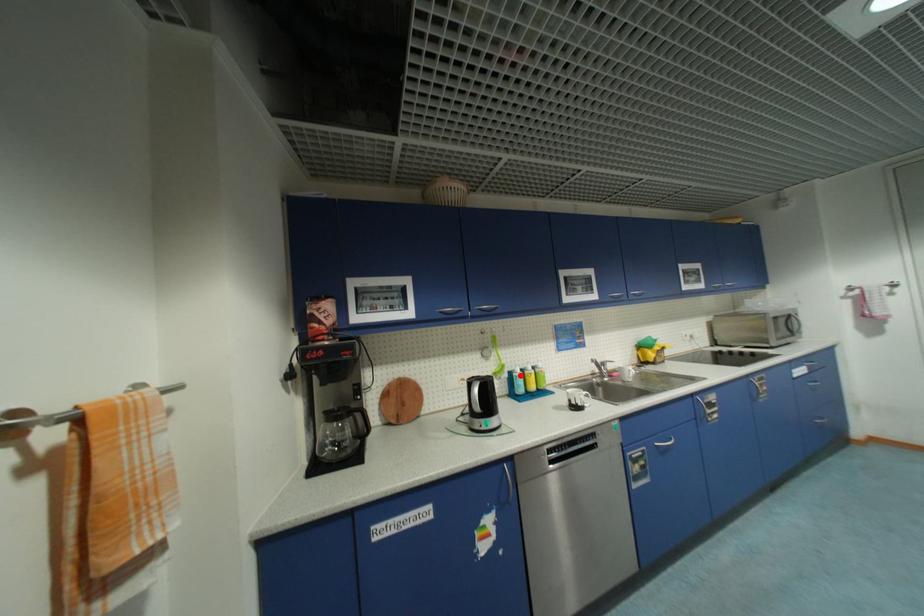
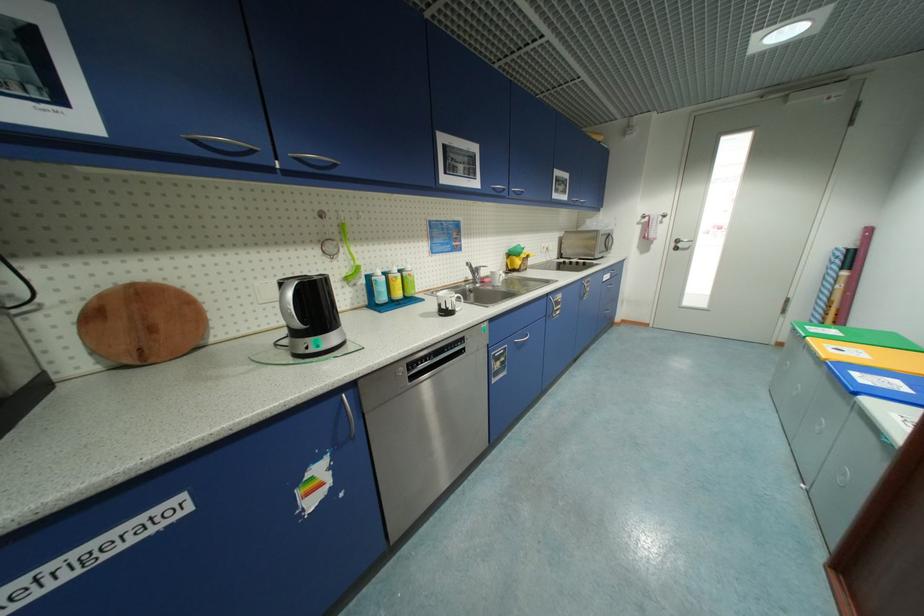
Question: I am providing you with two images of the same scene from different viewpoints. A red point is marked on the first image. At the location where the point appears in image 1, is it still visible in image 2?

Choices:
 (A) Yes
 (B) No

Answer: (A)